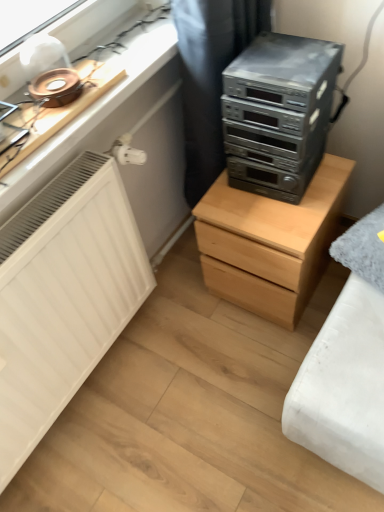
I want to click on vacant space positioned to the left of light wood chest of drawers at center, so click(188, 310).